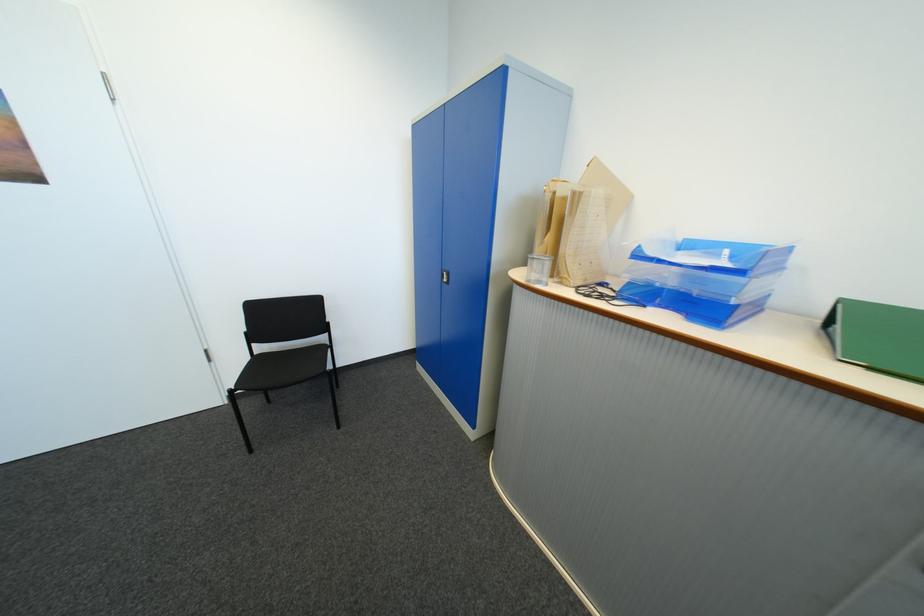
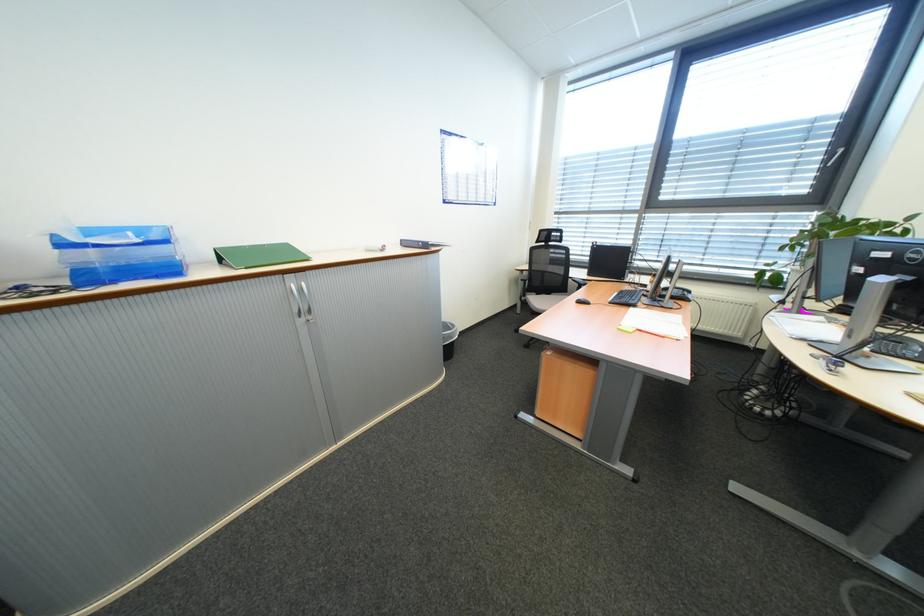
Question: I am providing you with two images of the same scene from different viewpoints. After the viewpoint changes to image2, which objects are now occluded?

Choices:
 (A) clear oil bottle
 (B) silver cabinet handle
 (C) chair armrest
 (D) green binder

Answer: (D)